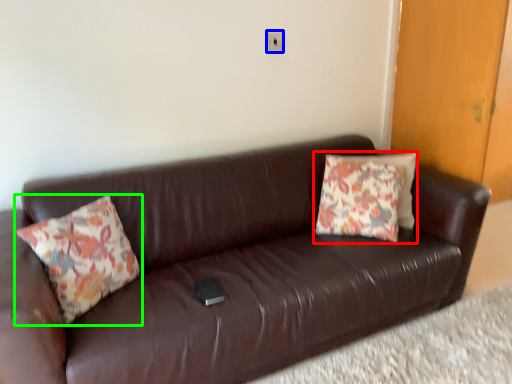
Question: Considering the real-world distances, which object is farthest from pillow (highlighted by a red box)? electric outlet (highlighted by a blue box) or pillow (highlighted by a green box)?

Choices:
 (A) electric outlet
 (B) pillow

Answer: (B)